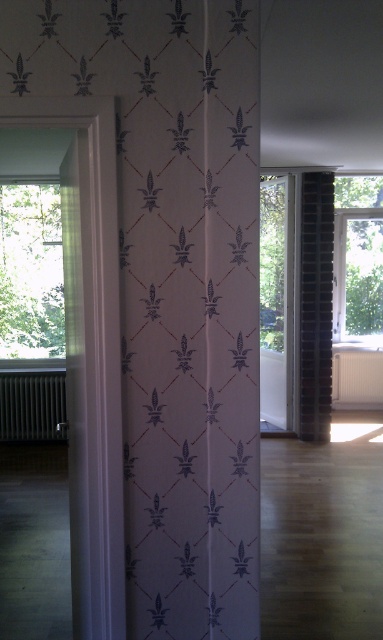
Question: Can you confirm if white paper curtain at center is positioned to the left of dark brick pillar at right?

Choices:
 (A) yes
 (B) no

Answer: (A)

Question: Can you confirm if transparent glass window at upper left is positioned to the left of white matte radiator at lower right?

Choices:
 (A) no
 (B) yes

Answer: (B)

Question: Based on their relative distances, which object is nearer to the black metallic radiator at left?

Choices:
 (A) white paper curtain at center
 (B) white matte radiator at lower right

Answer: (B)

Question: Among these points, which one is farthest from the camera?

Choices:
 (A) (34, 390)
 (B) (335, 353)
 (C) (142, 176)
 (D) (378, 264)

Answer: (D)

Question: Considering the relative positions of white paper curtain at center and transparent glass window at upper left in the image provided, where is white paper curtain at center located with respect to transparent glass window at upper left?

Choices:
 (A) above
 (B) below

Answer: (B)

Question: Which of these objects is positioned closest to the transparent glass window at upper left?

Choices:
 (A) dark brick pillar at right
 (B) black metallic radiator at left
 (C) white matte radiator at lower right
 (D) transparent glass window at right

Answer: (B)